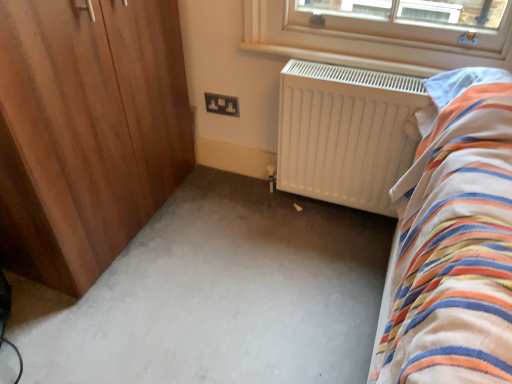
Question: Relative to black plastic socket at center, is wooden wardrobe at left in front or behind?

Choices:
 (A) behind
 (B) front

Answer: (B)

Question: From the image's perspective, is wooden wardrobe at left located above or below black plastic socket at center?

Choices:
 (A) below
 (B) above

Answer: (A)

Question: Considering the real-world distances, which object is closest to the white matte radiator at center?

Choices:
 (A) white carpet at center
 (B) wooden wardrobe at left
 (C) black plastic socket at center

Answer: (A)

Question: Considering the real-world distances, which object is closest to the wooden wardrobe at left?

Choices:
 (A) white carpet at center
 (B) black plastic socket at center
 (C) white matte radiator at center

Answer: (A)